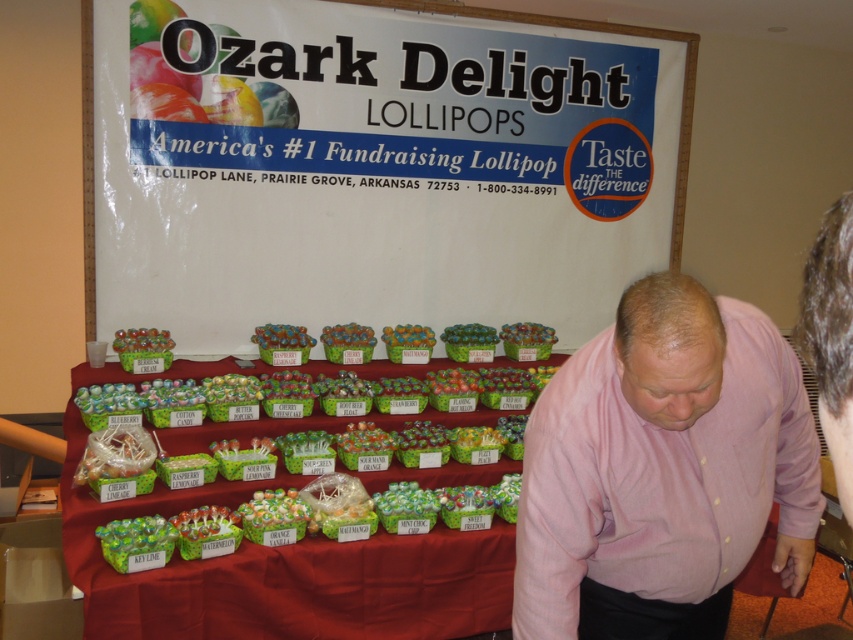
You are a customer looking at the display table and notice the white paperboard at upper center and the pink cotton shirt at lower right. Which object is taller?

The white paperboard at upper center is much taller than the pink cotton shirt at lower right.

You are a customer looking at the display table with the pink cotton shirt at lower right and the pink shirt at lower right. Which one is more to the left?

The pink cotton shirt at lower right is more to the left than the pink shirt at lower right.